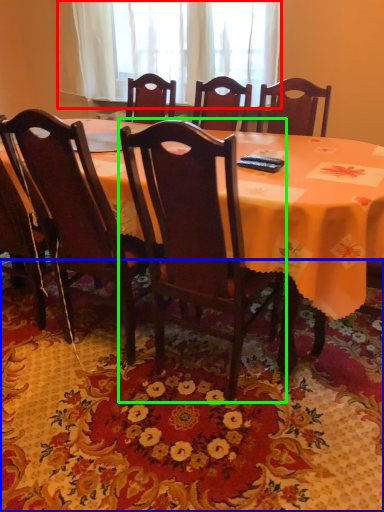
Question: Estimate the real-world distances between objects in this image. Which object is farther from curtain (highlighted by a red box), mat (highlighted by a blue box) or chair (highlighted by a green box)?

Choices:
 (A) mat
 (B) chair

Answer: (A)